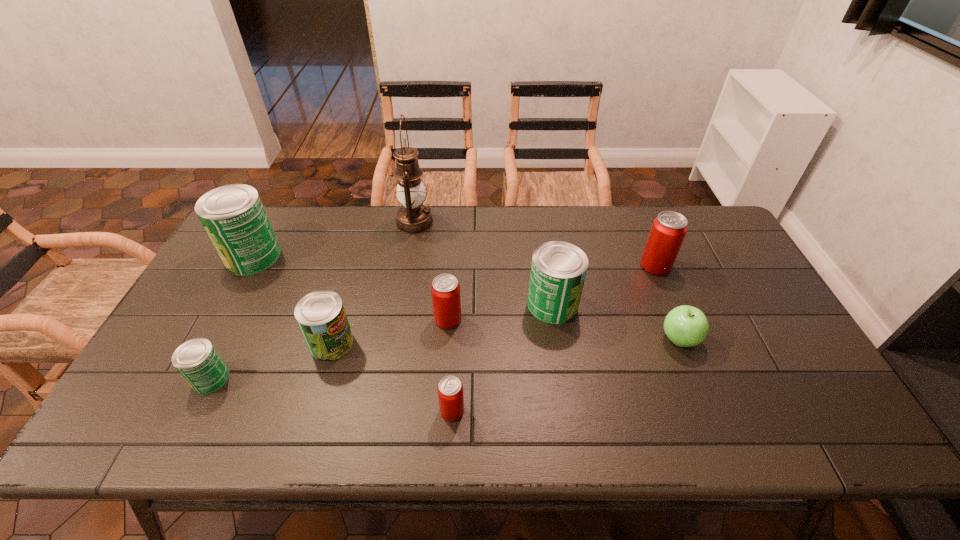
Locate an element on the screen. the second smallest green can is located at coordinates (321, 316).

At what (x,y) coordinates should I click in order to perform the action: click on green apple. Please return your answer as a coordinate pair (x, y). Image resolution: width=960 pixels, height=540 pixels. Looking at the image, I should click on click(686, 326).

Find the location of `the nearest can`. the nearest can is located at coordinates (450, 390).

I want to click on the smallest red can, so click(450, 390).

Locate an element on the screen. The image size is (960, 540). the second nearest object is located at coordinates (198, 362).

Where is `the second nearest can`? the second nearest can is located at coordinates (198, 362).

The height and width of the screenshot is (540, 960). I want to click on free space located 0.140m on the left of the farthest object, so click(355, 222).

This screenshot has width=960, height=540. Find the location of `vacant space located 0.310m on the front of the second tallest object`. vacant space located 0.310m on the front of the second tallest object is located at coordinates (197, 361).

Identify the location of blank space located on the left of the rightmost red can. (609, 266).

This screenshot has height=540, width=960. What are the coordinates of `vacant area situated on the left of the sixth can from left to right` in the screenshot? It's located at (444, 305).